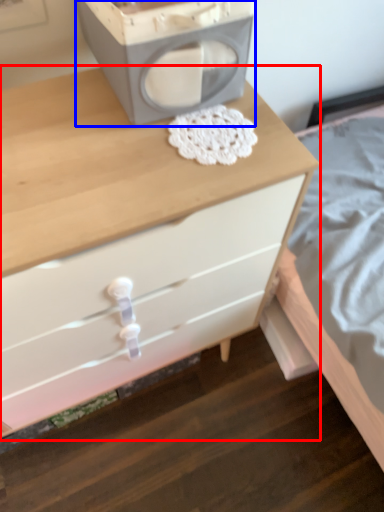
Question: Which point is further to the camera, chest of drawers (highlighted by a red box) or appliance (highlighted by a blue box)?

Choices:
 (A) chest of drawers
 (B) appliance

Answer: (B)